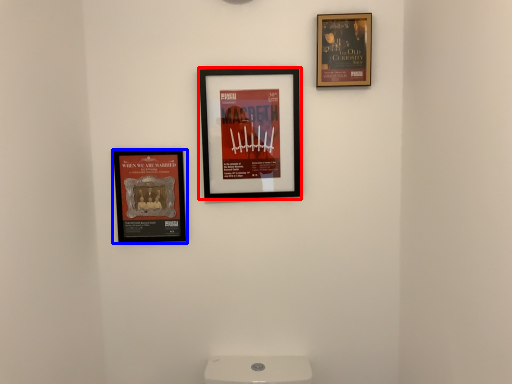
Question: Among these objects, which one is farthest to the camera, picture frame (highlighted by a red box) or picture frame (highlighted by a blue box)?

Choices:
 (A) picture frame
 (B) picture frame

Answer: (B)